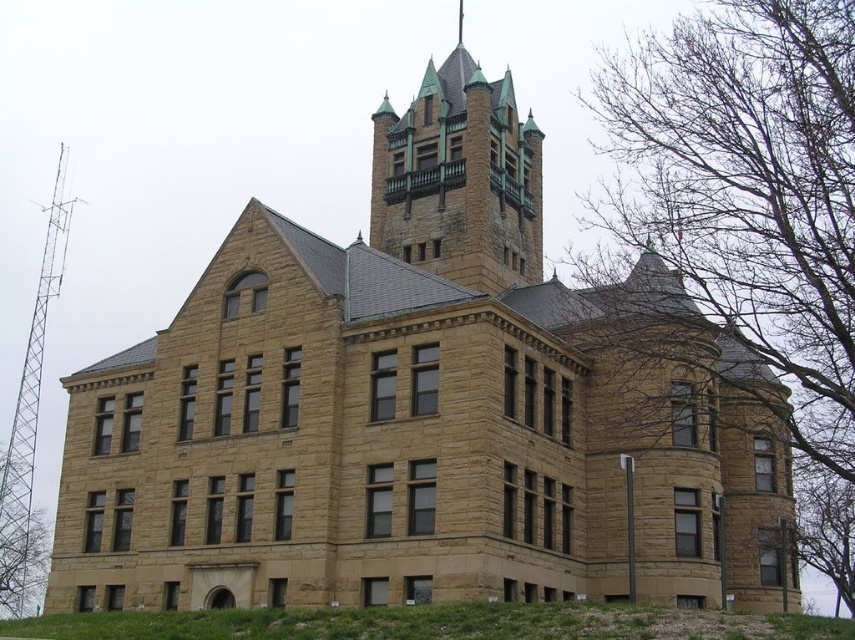
Question: Among these objects, which one is nearest to the camera?

Choices:
 (A) bare branches at right
 (B) green copper spires at upper center

Answer: (A)

Question: From the image, what is the correct spatial relationship of bare branches at right in relation to green copper spires at upper center?

Choices:
 (A) above
 (B) below

Answer: (B)

Question: Which object is farther from the camera taking this photo?

Choices:
 (A) green copper spires at upper center
 (B) bare branches at right

Answer: (A)

Question: Which point is closer to the camera?

Choices:
 (A) bare branches at right
 (B) green copper spires at upper center

Answer: (A)

Question: Where is bare branches at right located in relation to green copper spires at upper center in the image?

Choices:
 (A) above
 (B) below

Answer: (B)

Question: Does bare branches at right lie behind green copper spires at upper center?

Choices:
 (A) yes
 (B) no

Answer: (B)